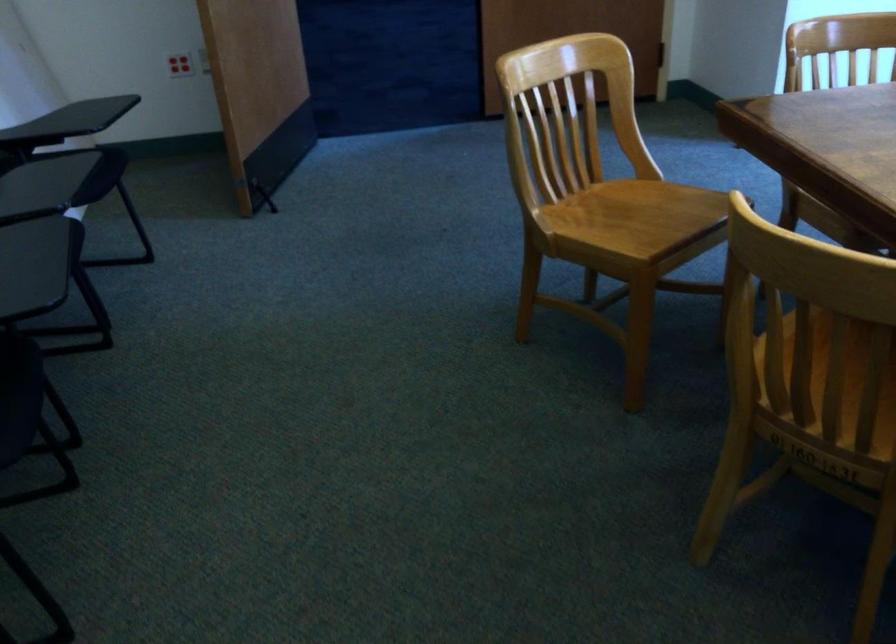
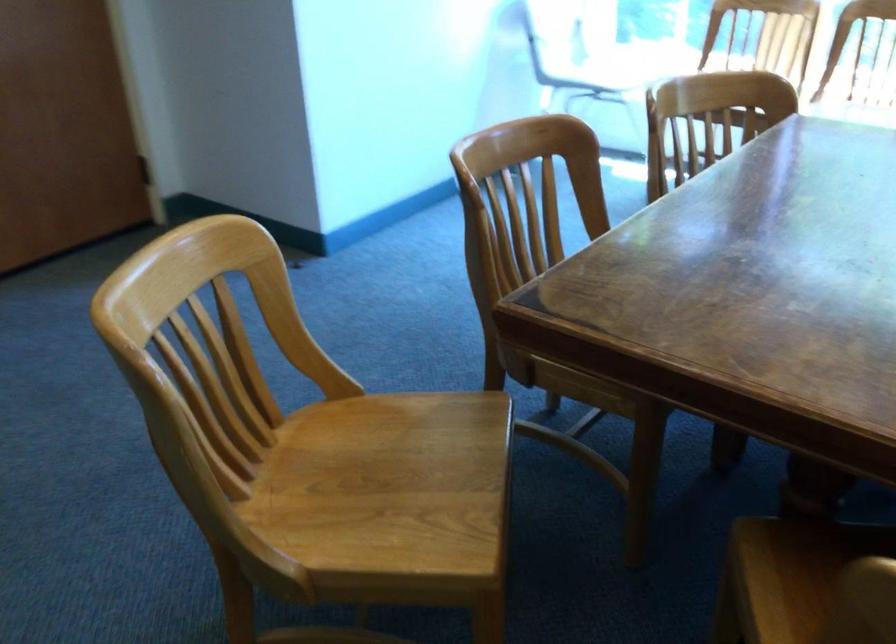
Where in the second image is the point corresponding to the point at 625,216 from the first image?

(383, 484)